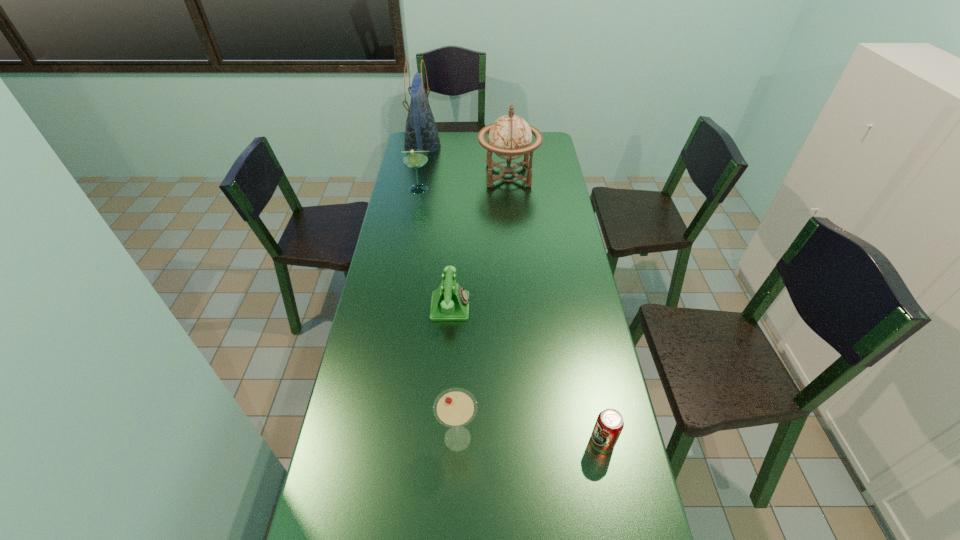
This screenshot has height=540, width=960. I want to click on blank space at the left edge, so click(x=385, y=406).

Locate an element on the screen. free spot at the right edge of the desktop is located at coordinates (538, 234).

Find the location of a particular element. free space at the far right corner is located at coordinates (543, 134).

Locate an element on the screen. The width and height of the screenshot is (960, 540). free space between the fourth farthest object and the shopping bag is located at coordinates (437, 226).

The image size is (960, 540). In order to click on vacant region between the second tallest object and the nearer martini in this screenshot , I will do `click(483, 307)`.

Find the location of `vacant region between the telephone and the farther martini`. vacant region between the telephone and the farther martini is located at coordinates (435, 248).

You are a GUI agent. You are given a task and a screenshot of the screen. Output one action in this format:
    pyautogui.click(x=<x>, y=<y>)
    Task: Click on the free space between the fifth shortest object and the shopping bag
    
    Given the screenshot: What is the action you would take?
    pyautogui.click(x=466, y=160)

The width and height of the screenshot is (960, 540). I want to click on vacant area between the farther martini and the third nearest object, so click(x=435, y=248).

At what (x,y) coordinates should I click in order to perform the action: click on free space between the right martini and the rightmost object. Please return your answer as a coordinate pair (x, y). Looking at the image, I should click on (530, 440).

Identify the location of free space between the soda and the right martini. (530, 440).